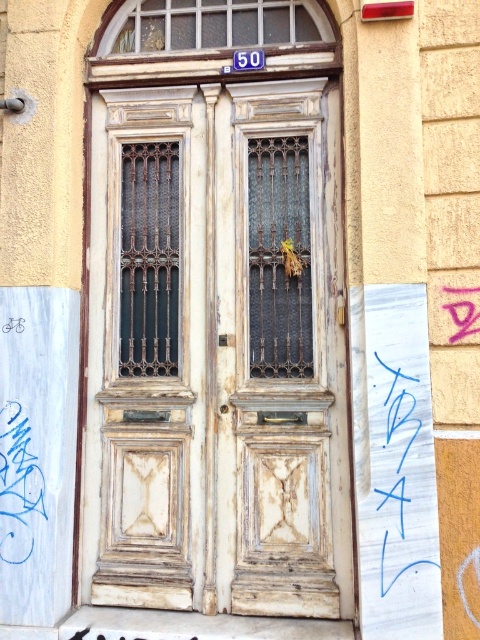
Can you confirm if white weathered wood door at center is positioned below blue marker writing at center?

Actually, white weathered wood door at center is above blue marker writing at center.

Where is `white weathered wood door at center`? white weathered wood door at center is located at coordinates (217, 353).